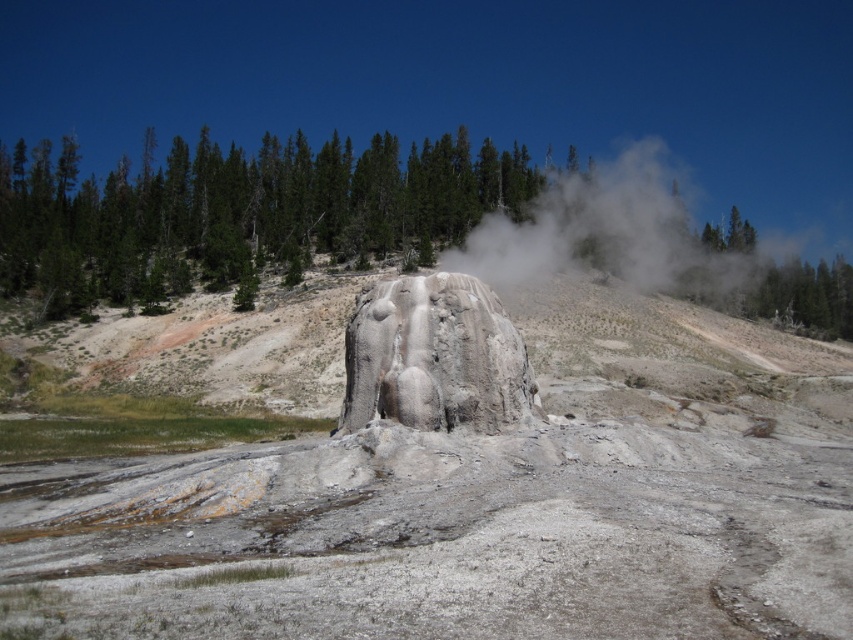
Question: Does green textured trees at upper center have a smaller size compared to gray textured rock at center?

Choices:
 (A) no
 (B) yes

Answer: (A)

Question: Can you confirm if green textured trees at upper center is smaller than white vapor at center?

Choices:
 (A) no
 (B) yes

Answer: (A)

Question: Which is farther from the green textured trees at upper center?

Choices:
 (A) white vapor at center
 (B) gray rock formation at center

Answer: (A)

Question: Which of the following is the closest to the observer?

Choices:
 (A) white vapor at center
 (B) gray textured rock at center

Answer: (B)

Question: Is gray rock formation at center positioned in front of white vapor at center?

Choices:
 (A) no
 (B) yes

Answer: (A)

Question: Estimate the real-world distances between objects in this image. Which object is closer to the gray/rough rock formation at center?

Choices:
 (A) green textured trees at upper center
 (B) gray rock formation at center
 (C) gray textured rock at center
 (D) white vapor at center

Answer: (B)